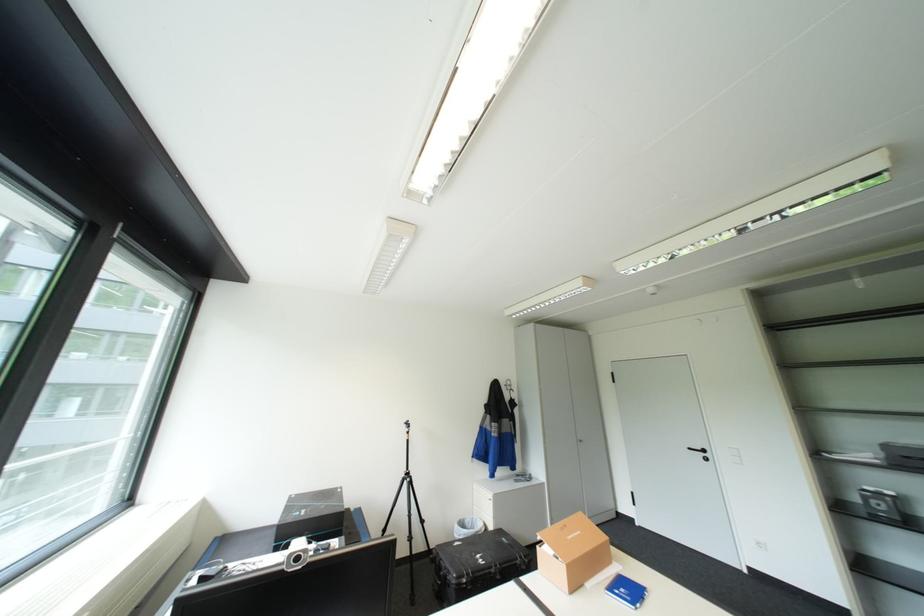
You are a GUI agent. You are given a task and a screenshot of the screen. Output one action in this format:
    pyautogui.click(x=<x>, y=<y>)
    Task: Click on the small webcam
    The image size is (924, 616).
    Given the screenshot: What is the action you would take?
    pyautogui.click(x=651, y=290)